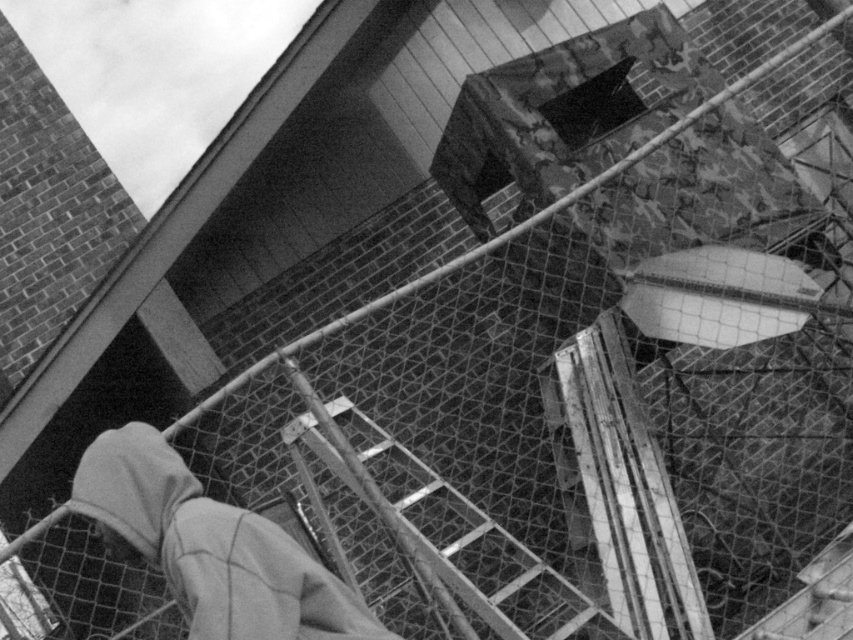
Question: Can you confirm if gray fleece hoodie at lower left is positioned below metallic silver ladder at center?

Choices:
 (A) no
 (B) yes

Answer: (B)

Question: Is gray fleece hoodie at lower left smaller than metallic silver ladder at center?

Choices:
 (A) no
 (B) yes

Answer: (B)

Question: Which object is closer to the camera taking this photo?

Choices:
 (A) metallic silver ladder at center
 (B) gray fleece hoodie at lower left

Answer: (B)

Question: Which of the following is the closest to the observer?

Choices:
 (A) (492, 552)
 (B) (614, 586)

Answer: (B)

Question: Estimate the real-world distances between objects in this image. Which object is farther from the metallic silver ladder at center?

Choices:
 (A) gray fleece hoodie at lower left
 (B) wooden at center

Answer: (A)

Question: Is gray fleece hoodie at lower left to the left of wooden at center from the viewer's perspective?

Choices:
 (A) no
 (B) yes

Answer: (B)